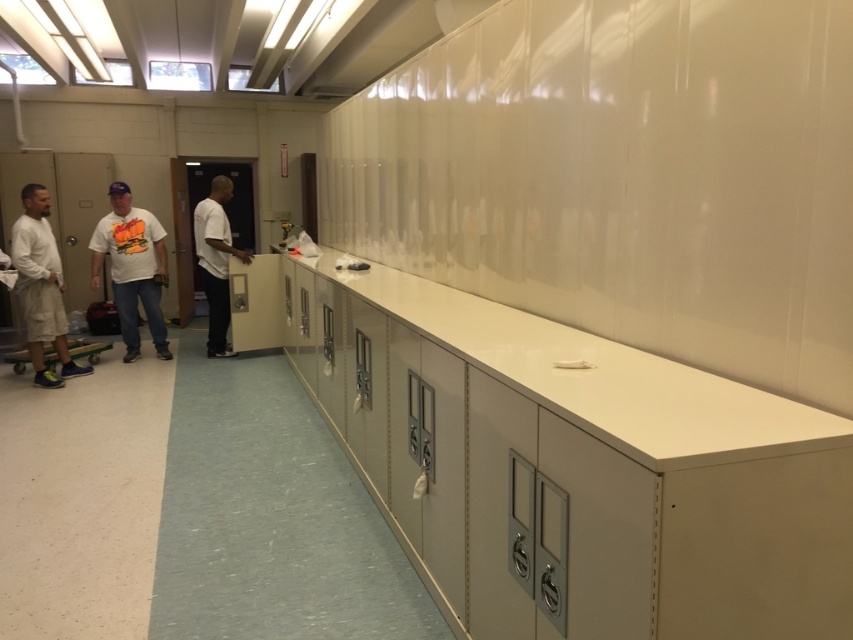
You are organizing a storage area and see the matte khaki shorts at left and the white matte shirt at center. Which item is positioned more to the left side?

The matte khaki shorts at left are positioned more to the left side than the white matte shirt at center.